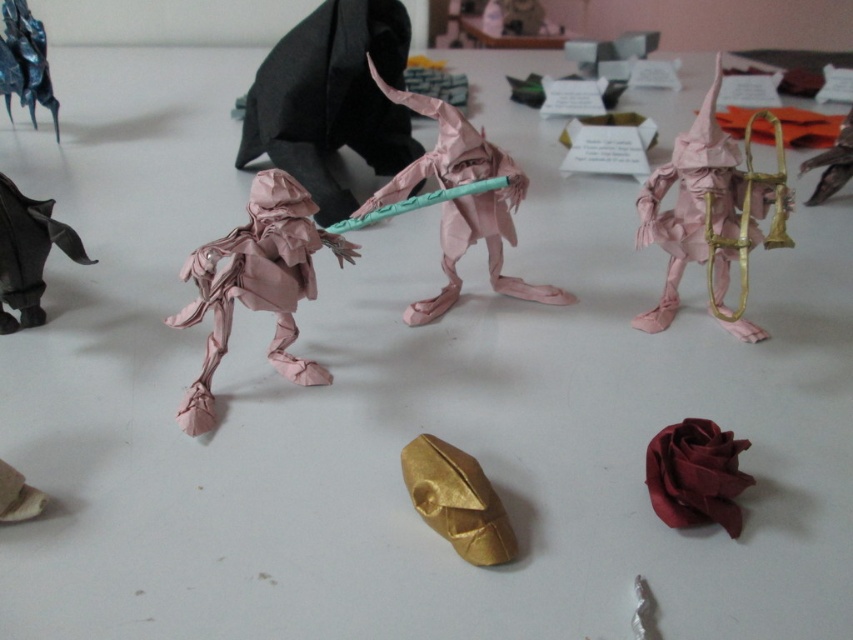
You are an artist who wants to create a new origami piece that will fit between the pink paper wizard at upper right and the matte red paper rose at lower right. Based on their sizes, which existing origami piece should you use as a reference to ensure your new creation is appropriately sized?

Since the pink paper wizard at upper right is larger than the matte red paper rose at lower right, you should use the pink paper wizard at upper right as a reference to ensure your new creation is appropriately sized.

You are organizing an exhibition and need to place a new origami piece between the golden origami figure in the foreground and the matte pink paper at center. Based on their positions, where should you position the new piece?

The new origami piece should be placed between the golden origami figure in the foreground and the matte pink paper at center. Since the matte pink paper at center is located at point (331, 99), you should position the new piece along the line connecting the two objects, ensuring it is midway between them.